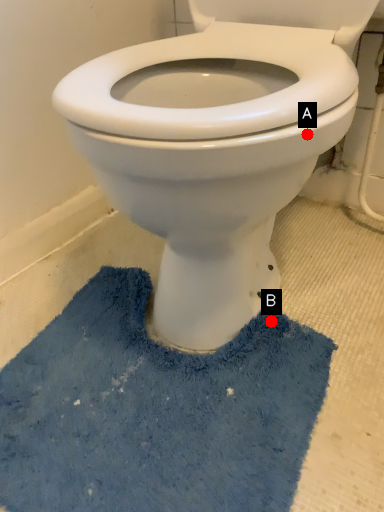
Question: Two points are circled on the image, labeled by A and B beside each circle. Which point is closer to the camera taking this photo?

Choices:
 (A) A is closer
 (B) B is closer

Answer: (A)